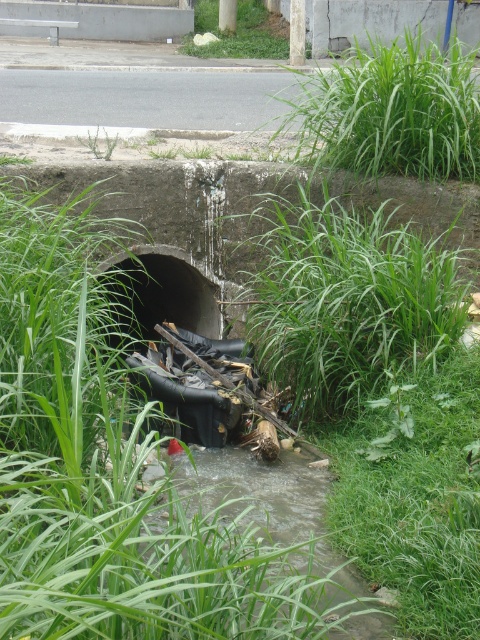
Question: Which is nearer to the green leafy weed at center?

Choices:
 (A) black rubber hole at center
 (B) green leafy grass at center
 (C) green leafy grass at upper right
 (D) clear water stream at center

Answer: (D)

Question: Is clear water stream at center to the right of black rubber hole at center from the viewer's perspective?

Choices:
 (A) yes
 (B) no

Answer: (A)

Question: Does black rubber hole at center lie behind green leafy weed at center?

Choices:
 (A) no
 (B) yes

Answer: (B)

Question: Estimate the real-world distances between objects in this image. Which object is closer to the clear water stream at center?

Choices:
 (A) green leafy weed at center
 (B) green leafy grass at center

Answer: (A)

Question: Can you confirm if clear water stream at center is positioned above green leafy weed at center?

Choices:
 (A) no
 (B) yes

Answer: (A)

Question: Which point is farther to the camera?

Choices:
 (A) green leafy grass at upper right
 (B) black rubber hole at center
 (C) green leafy weed at center
 (D) clear water stream at center

Answer: (B)